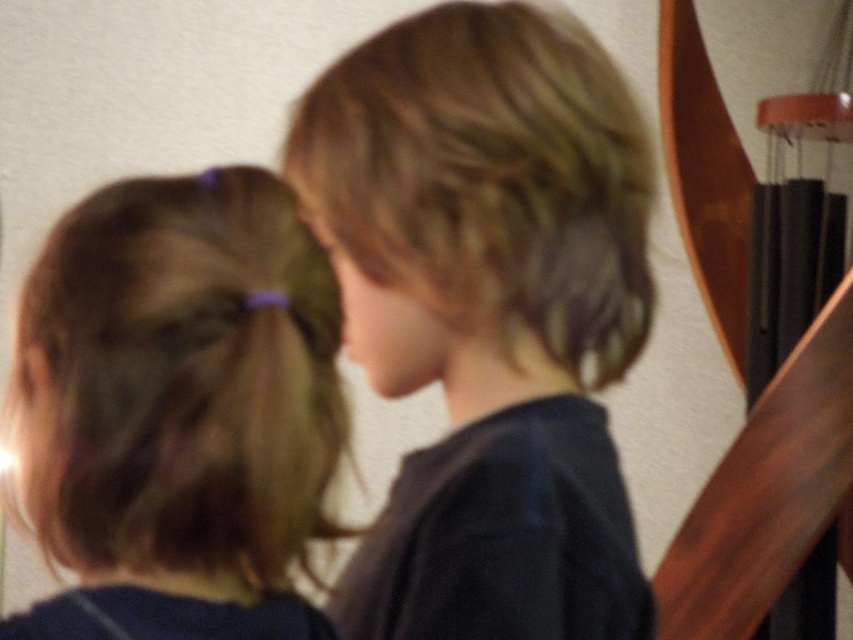
Question: Is blonde hair at center wider than brown hair at left?

Choices:
 (A) yes
 (B) no

Answer: (A)

Question: Among these objects, which one is nearest to the camera?

Choices:
 (A) brown hair at left
 (B) blonde hair at center

Answer: (A)

Question: Does blonde hair at center lie in front of brown hair at left?

Choices:
 (A) no
 (B) yes

Answer: (A)

Question: Which object is closer to the camera taking this photo?

Choices:
 (A) brown hair at left
 (B) blonde hair at center

Answer: (A)

Question: Does blonde hair at center appear under brown hair at left?

Choices:
 (A) no
 (B) yes

Answer: (A)

Question: Which object is farther from the camera taking this photo?

Choices:
 (A) brown hair at left
 (B) blonde hair at center

Answer: (B)